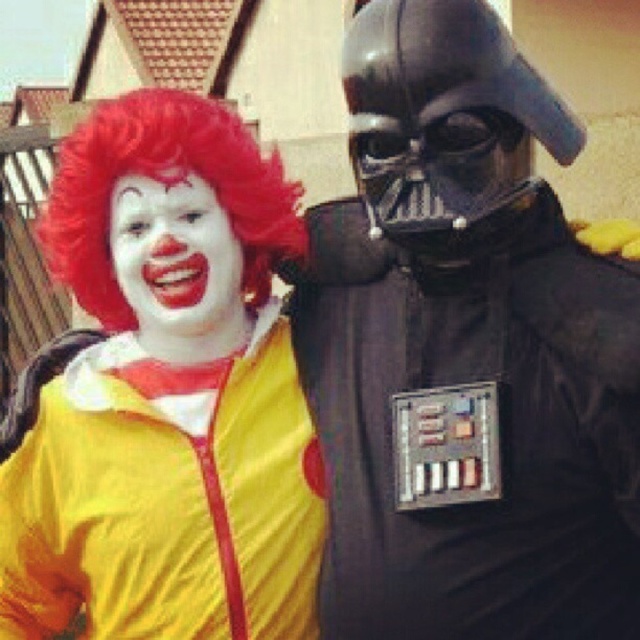
Question: Which point is farther to the camera?

Choices:
 (A) (368, 237)
 (B) (12, 636)

Answer: (A)

Question: Is yellow matte clown costume at left to the left of red synthetic wig at left from the viewer's perspective?

Choices:
 (A) yes
 (B) no

Answer: (A)

Question: Which point is closer to the camera?

Choices:
 (A) red synthetic wig at left
 (B) yellow matte clown costume at left
 (C) black matte armor at center

Answer: (C)

Question: Which object appears closest to the camera in this image?

Choices:
 (A) black matte armor at center
 (B) red synthetic wig at left

Answer: (A)

Question: Is black matte armor at center wider than red synthetic wig at left?

Choices:
 (A) yes
 (B) no

Answer: (B)

Question: In this image, where is black matte armor at center located relative to red synthetic wig at left?

Choices:
 (A) left
 (B) right

Answer: (B)